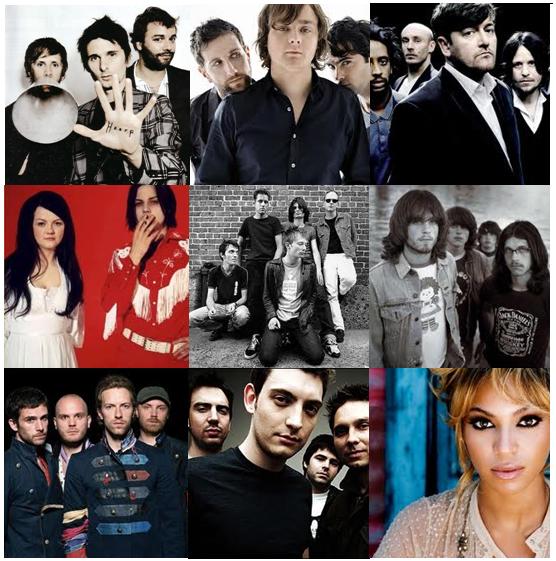
This screenshot has width=556, height=561. In order to click on picture in this screenshot , I will do `click(131, 498)`, `click(275, 503)`, `click(445, 509)`, `click(424, 306)`, `click(305, 287)`, `click(64, 266)`, `click(128, 82)`, `click(305, 105)`, `click(428, 130)`.